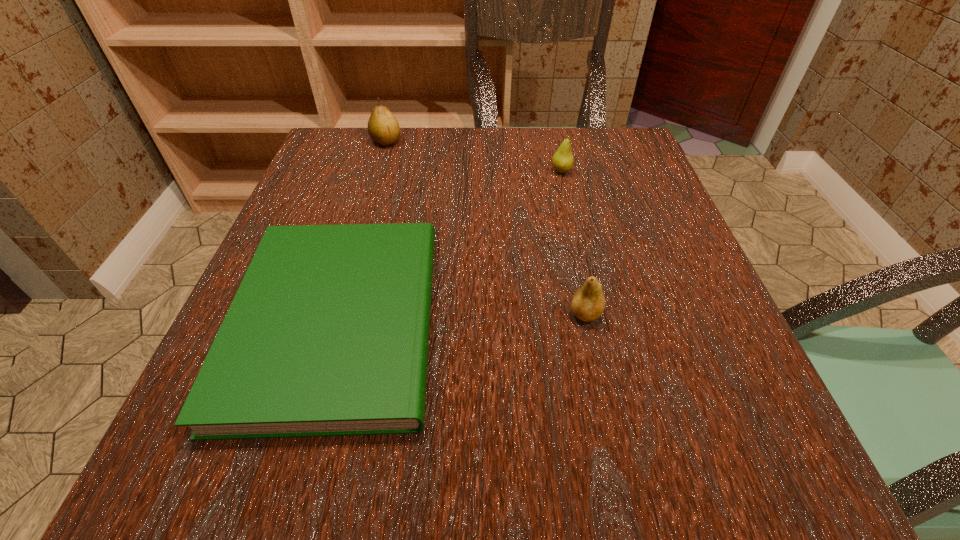
Identify which object is located as the third nearest to the nearest pear. Please provide its 2D coordinates. Your answer should be formatted as a tuple, i.e. [(x, y)], where the tuple contains the x and y coordinates of a point satisfying the conditions above.

[(383, 128)]

Identify which pear is the second closest to the nearest pear. Please provide its 2D coordinates. Your answer should be formatted as a tuple, i.e. [(x, y)], where the tuple contains the x and y coordinates of a point satisfying the conditions above.

[(383, 128)]

Locate which pear is the closest to the shortest object. Please provide its 2D coordinates. Your answer should be formatted as a tuple, i.e. [(x, y)], where the tuple contains the x and y coordinates of a point satisfying the conditions above.

[(588, 303)]

Where is `vacant space that satisfies the following two spatial constraints: 1. on the back side of the nearest pear; 2. on the left side of the second farthest pear`? The image size is (960, 540). vacant space that satisfies the following two spatial constraints: 1. on the back side of the nearest pear; 2. on the left side of the second farthest pear is located at coordinates (555, 171).

Identify the location of free spot that satisfies the following two spatial constraints: 1. on the front side of the farthest object; 2. on the left side of the nearest pear. (335, 314).